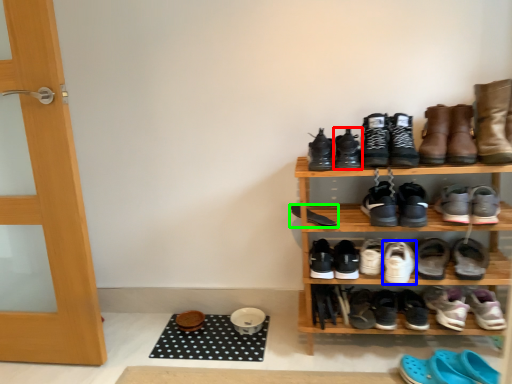
Question: Which object is positioned closest to footwear (highlighted by a red box)? Select from footwear (highlighted by a blue box) and footwear (highlighted by a green box).

Choices:
 (A) footwear
 (B) footwear

Answer: (B)